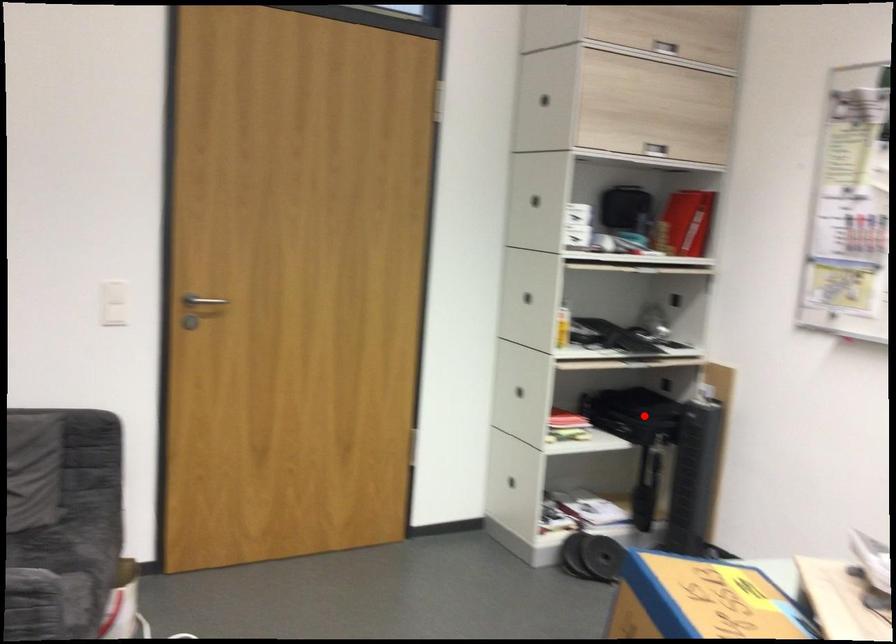
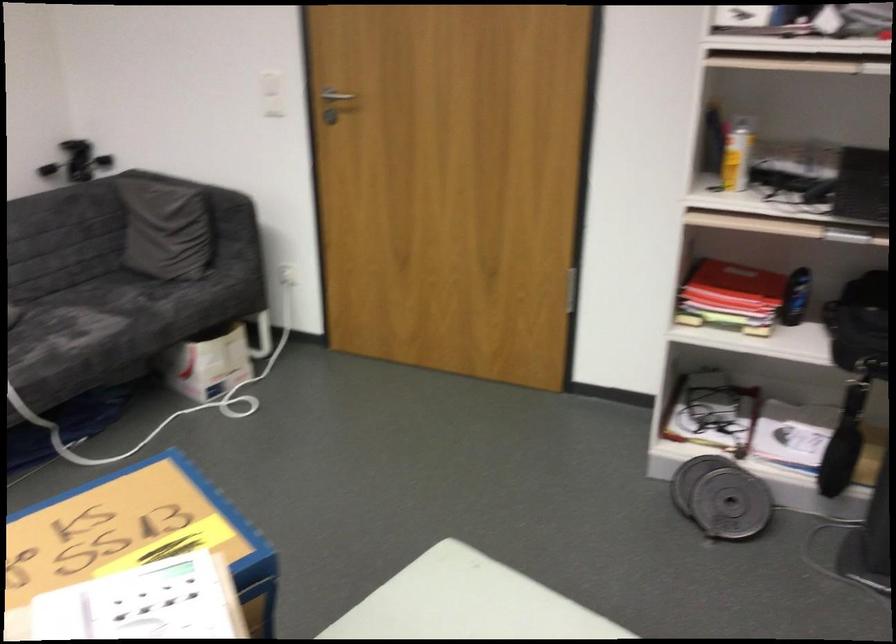
Question: I am providing you with two images of the same scene from different viewpoints. Image1 has a red point marked. In image2, the corresponding 3D location appears at what relative position? Reply with the corresponding letter.

Choices:
 (A) Closer
 (B) Farther

Answer: (A)